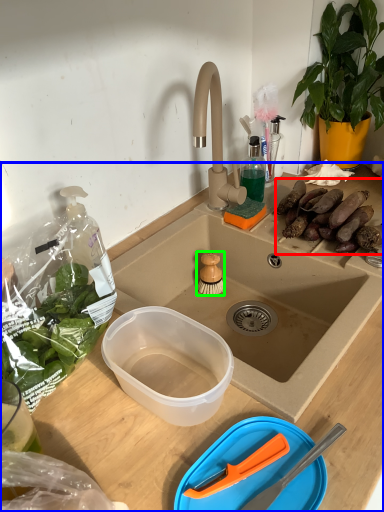
Question: Based on their relative distances, which object is nearer to food (highlighted by a red box)? Choose from desk (highlighted by a blue box) and brush (highlighted by a green box).

Choices:
 (A) desk
 (B) brush

Answer: (A)